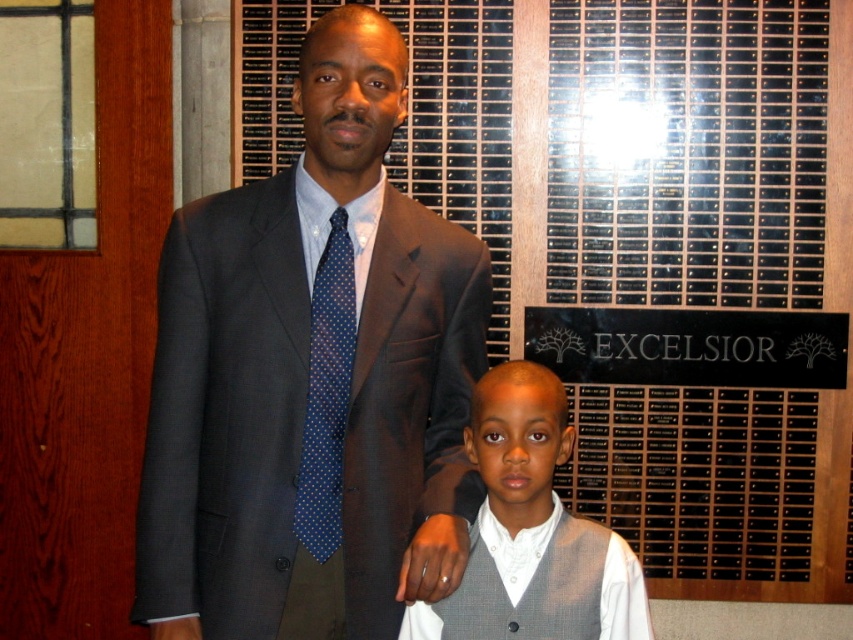
In the scene shown: You are standing in the formal setting described in the scene. You need to locate the matte gray suit at center. According to the coordinates provided, where exactly would you find it?

The matte gray suit at center is located at the coordinates point (312, 380).

You are an assistant organizing a formal event. You need to ensure that the matte gray suit at center and the blue dotted tie at center are displayed properly. Based on their positions, which object should be placed higher on the display rack?

The matte gray suit at center should be placed higher on the display rack since it is located above the blue dotted tie at center in the image.

Based on the photo, you are standing in front of the two people in the image. There are two points marked in the scene. The first point is at coordinate point[554,570] and the second point is at coordinate point[341,332]. If you want to touch both points with your finger, which point should you reach for first to touch the one closer to you?

Point[341,332] is closer to you than point[554,570], so you should reach for point[341,332] first.